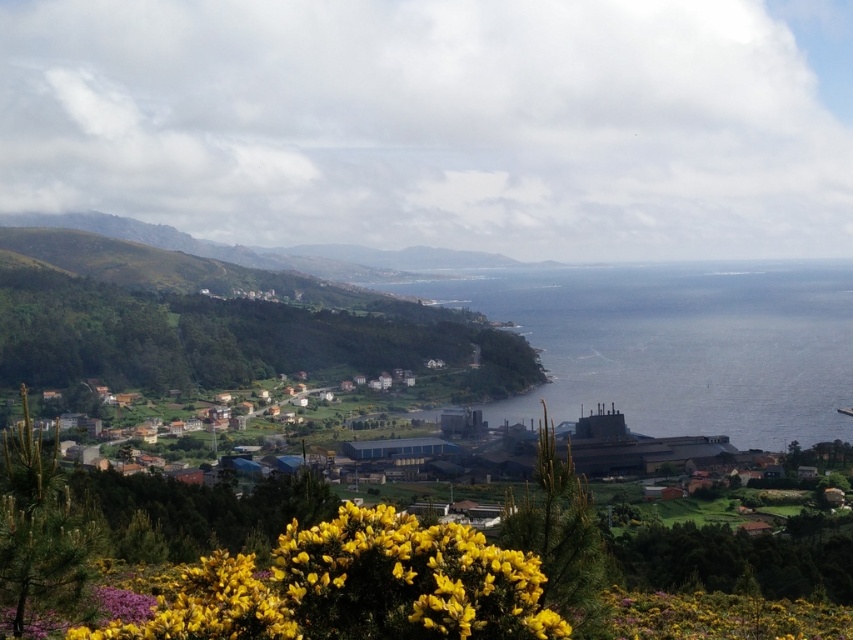
You are a photographer standing at the edge of the coastal village. You want to capture a shot that includes both the blue water at center and the yellow matte flower at lower center. Which object should you position closer to the right side of your camera frame?

The blue water at center should be positioned closer to the right side of your camera frame because it is located on the right side of the yellow matte flower at lower center.

You are standing at the edge of the coastal village and want to determine the relative positions of two points in the scene. The first point is located at coordinates point (x=791, y=268), and the second point is at point (x=357, y=531). Which point is closer to you?

Point (x=791, y=268) is further to the viewer than point (x=357, y=531), so the point at (x=357, y=531) is closer to you.